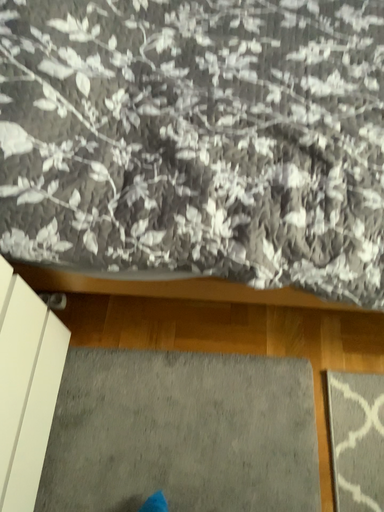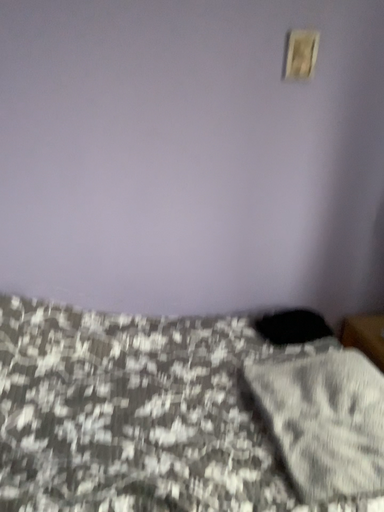
Question: Which way did the camera rotate in the video?

Choices:
 (A) rotated upward
 (B) rotated downward

Answer: (A)